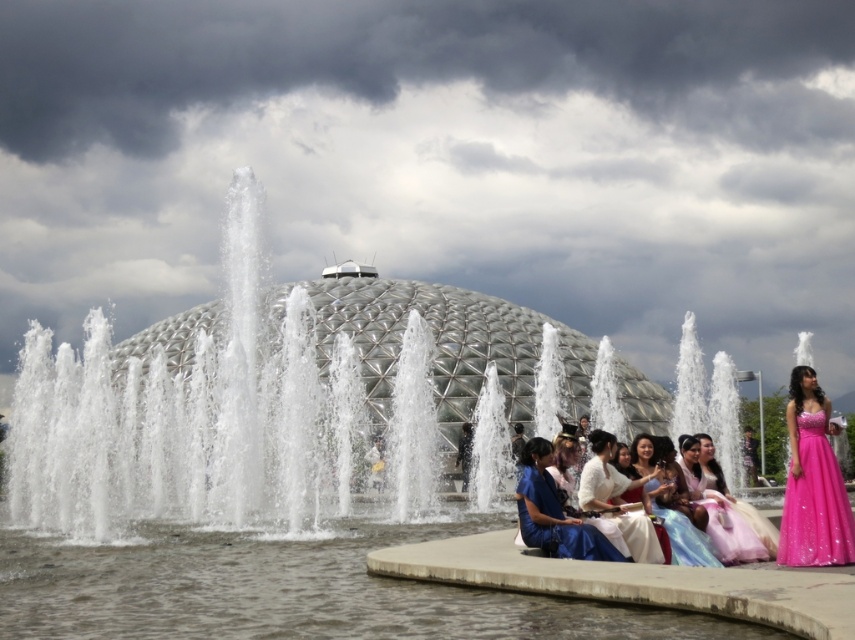
Does pink sequined dress at right come in front of pink satin dress at lower right?

Yes, it is.

Where is `pink sequined dress at right`? pink sequined dress at right is located at coordinates (815, 500).

Does pink sequined dress at right have a lesser width compared to white satin dress at center?

Yes.

Can you confirm if pink sequined dress at right is positioned above white satin dress at center?

Indeed, pink sequined dress at right is positioned over white satin dress at center.

Is point (839, 547) farther from viewer compared to point (640, 524)?

No, (839, 547) is closer to viewer.

This screenshot has height=640, width=855. I want to click on pink sequined dress at right, so click(x=815, y=500).

Is white satin dress at center closer to camera compared to matte pink dress at center?

No.

Which is behind, point (644, 538) or point (705, 547)?

The point (705, 547) is more distant.

Is point (634, 554) positioned behind point (659, 500)?

That is False.

This screenshot has height=640, width=855. In order to click on white satin dress at center in this screenshot , I will do 602,476.